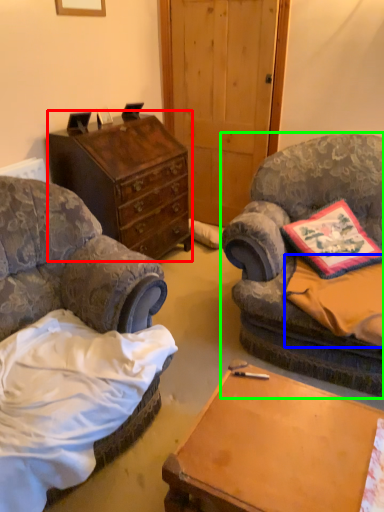
Question: Which object is the closest to the chest of drawers (highlighted by a red box)? Choose among these: sheet (highlighted by a blue box) or chair (highlighted by a green box).

Choices:
 (A) sheet
 (B) chair

Answer: (B)